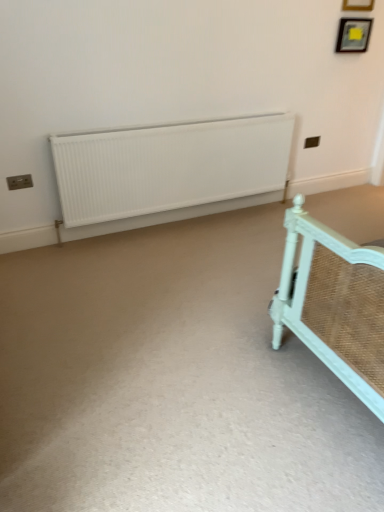
Question: Does wooden picture frame at upper right, the first picture frame when ordered from top to bottom, have a lesser height compared to wooden picture frame at upper right, which is the 1th picture frame in bottom-to-top order?

Choices:
 (A) no
 (B) yes

Answer: (A)

Question: Is wooden picture frame at upper right, the first picture frame when ordered from top to bottom, positioned far away from wooden picture frame at upper right, which is the 1th picture frame in bottom-to-top order?

Choices:
 (A) no
 (B) yes

Answer: (A)

Question: Can we say wooden picture frame at upper right, the second picture frame in the bottom-to-top sequence, lies outside wooden picture frame at upper right, which is the 1th picture frame in bottom-to-top order?

Choices:
 (A) no
 (B) yes

Answer: (B)

Question: From the image's perspective, would you say wooden picture frame at upper right, the first picture frame when ordered from top to bottom, is positioned over wooden picture frame at upper right, which is the 1th picture frame in bottom-to-top order?

Choices:
 (A) no
 (B) yes

Answer: (B)

Question: Would you say wooden picture frame at upper right, the second picture frame in the bottom-to-top sequence, contains wooden picture frame at upper right, which is the 1th picture frame in bottom-to-top order?

Choices:
 (A) yes
 (B) no

Answer: (B)

Question: Does wooden picture frame at upper right, the second picture frame in the bottom-to-top sequence, have a greater width compared to wooden picture frame at upper right, acting as the 2th picture frame starting from the top?

Choices:
 (A) yes
 (B) no

Answer: (B)

Question: From the image's perspective, is white matte radiator at center located above wooden picture frame at upper right, acting as the 2th picture frame starting from the top?

Choices:
 (A) no
 (B) yes

Answer: (A)

Question: Does white matte radiator at center have a smaller size compared to wooden picture frame at upper right, acting as the 2th picture frame starting from the top?

Choices:
 (A) no
 (B) yes

Answer: (A)

Question: Considering the relative positions of white matte radiator at center and wooden picture frame at upper right, which is the 1th picture frame in bottom-to-top order, in the image provided, is white matte radiator at center behind wooden picture frame at upper right, which is the 1th picture frame in bottom-to-top order,?

Choices:
 (A) no
 (B) yes

Answer: (A)

Question: Considering the relative sizes of white matte radiator at center and wooden picture frame at upper right, which is the 1th picture frame in bottom-to-top order, in the image provided, is white matte radiator at center bigger than wooden picture frame at upper right, which is the 1th picture frame in bottom-to-top order,?

Choices:
 (A) no
 (B) yes

Answer: (B)

Question: Considering the relative positions of white matte radiator at center and wooden picture frame at upper right, acting as the 2th picture frame starting from the top, in the image provided, is white matte radiator at center to the left of wooden picture frame at upper right, acting as the 2th picture frame starting from the top, from the viewer's perspective?

Choices:
 (A) yes
 (B) no

Answer: (A)

Question: Is white matte radiator at center in front of wooden picture frame at upper right, acting as the 2th picture frame starting from the top?

Choices:
 (A) no
 (B) yes

Answer: (B)

Question: Does white matte radiator at center have a greater width compared to wooden picture frame at upper right, the second picture frame in the bottom-to-top sequence?

Choices:
 (A) yes
 (B) no

Answer: (A)